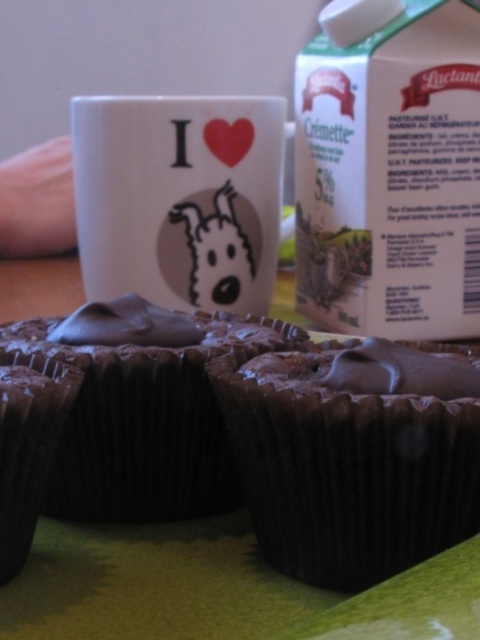
You are holding a spoon and want to reach the point at coordinate point (x=228, y=461) to taste the chocolate. The spoon is 8 inches long. Can you reach the point with the spoon without moving your hand?

The distance of point (x=228, y=461) from camera is 26.57 inches, so the spoon is only 8 inches long. You cannot reach the point with the spoon without moving your hand because the spoon is too short.

You are a baker who wants to place both the chocolate paper cupcake at center and the chocolate matte cupcake at lower left onto a dessert tray. Which cupcake should you place first if you want to ensure the bigger one is in the center?

The chocolate paper cupcake at center is bigger than the chocolate matte cupcake at lower left, so you should place the chocolate paper cupcake at center first to ensure it is in the center position.

You are arranging cupcakes on a plate for a party. You have two cupcakes to place on the plate. The chocolate matte cupcake at center and the chocolate matte cupcake at lower left. Which one should you choose if you want the wider one?

The chocolate matte cupcake at center might be wider than chocolate matte cupcake at lower left, so you should choose the chocolate matte cupcake at center.